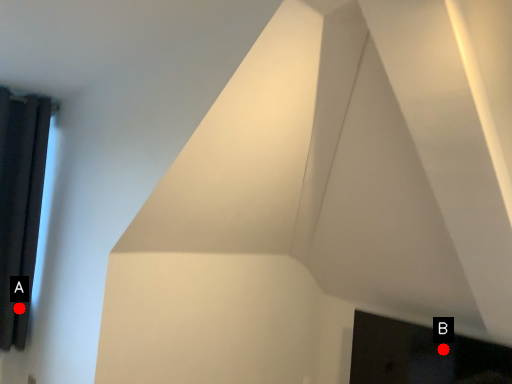
Question: Two points are circled on the image, labeled by A and B beside each circle. Which point is farther to the camera?

Choices:
 (A) A is further
 (B) B is further

Answer: (A)